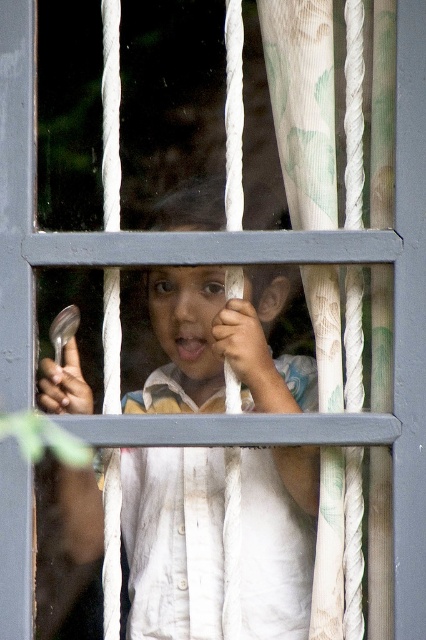
Question: Which point is farther to the camera?

Choices:
 (A) (294, 200)
 (B) (238, 300)

Answer: (A)

Question: Among these points, which one is nearest to the camera?

Choices:
 (A) (377, 212)
 (B) (261, 544)

Answer: (A)

Question: Which of the following is the farthest from the observer?

Choices:
 (A) white cotton shirt at center
 (B) white textured curtain at right

Answer: (A)

Question: Can you confirm if white cotton shirt at center is positioned above white textured curtain at right?

Choices:
 (A) yes
 (B) no

Answer: (B)

Question: Can you confirm if white cotton shirt at center is positioned below white textured curtain at right?

Choices:
 (A) yes
 (B) no

Answer: (A)

Question: Can you confirm if white cotton shirt at center is positioned above white textured curtain at right?

Choices:
 (A) yes
 (B) no

Answer: (B)